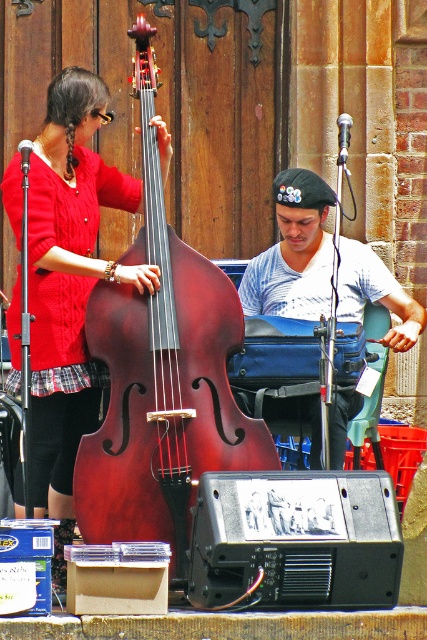
Question: Does shiny dark wood cello at center appear on the right side of matte red sweater at center?

Choices:
 (A) yes
 (B) no

Answer: (A)

Question: Which point is farther to the camera?

Choices:
 (A) (365, 253)
 (B) (11, 316)
 (C) (146, 317)

Answer: (A)

Question: Estimate the real-world distances between objects in this image. Which object is closer to the striped cotton shirt at center?

Choices:
 (A) matte red sweater at center
 (B) shiny dark wood cello at center

Answer: (B)

Question: Which point appears closest to the camera in this image?

Choices:
 (A) (312, 179)
 (B) (178, 237)
 (C) (52, 502)

Answer: (B)

Question: Is matte red sweater at center smaller than striped cotton shirt at center?

Choices:
 (A) no
 (B) yes

Answer: (A)

Question: Can you confirm if matte red sweater at center is bigger than striped cotton shirt at center?

Choices:
 (A) yes
 (B) no

Answer: (A)